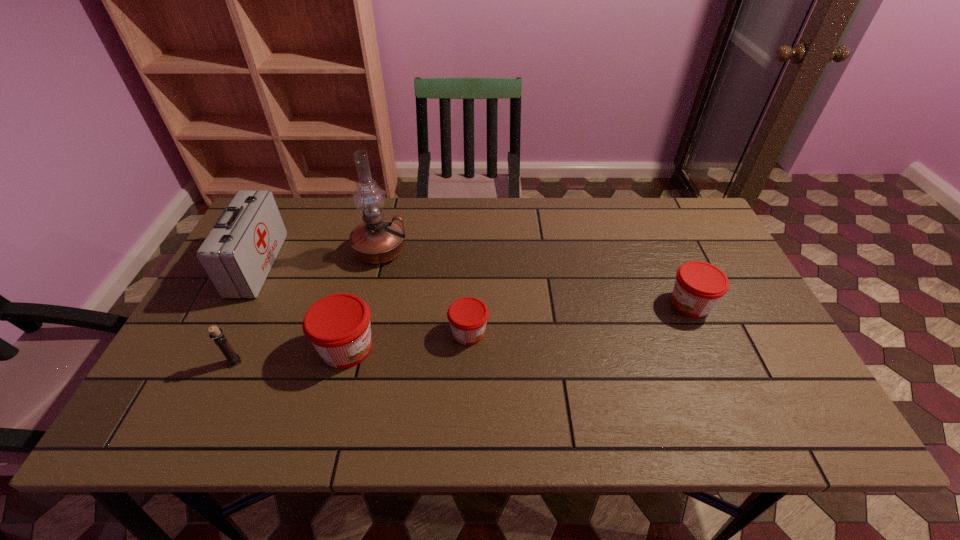
If equal spacing is the goal by inserting an additional jam among them, please point out a vacant space for this new jam. Please provide its 2D coordinates. Your answer should be formatted as a tuple, i.e. [(x, y)], where the tuple contains the x and y coordinates of a point satisfying the conditions above.

[(583, 318)]